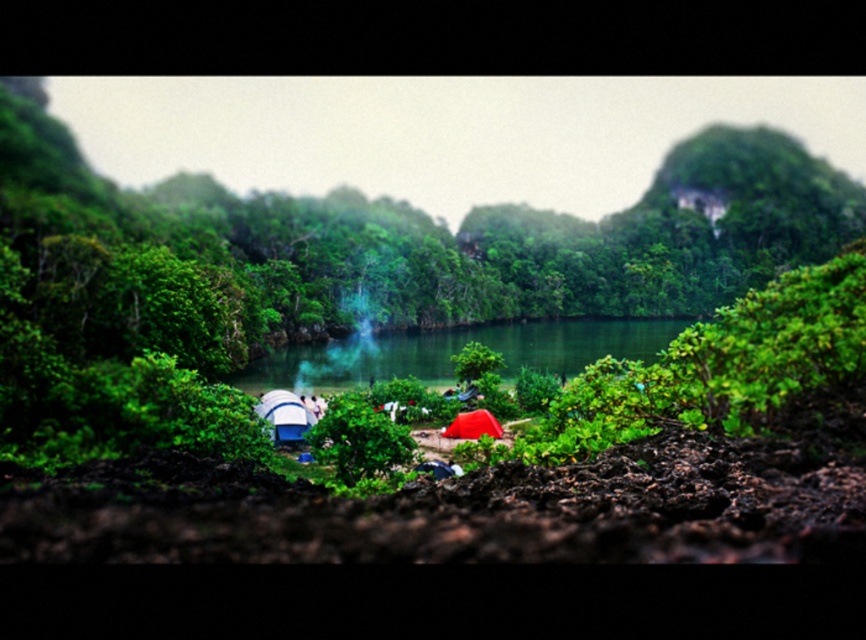
You are a hiker who wants to cross the green smooth water at center to reach the green leafy bush at center. Is the bush located to the right or left side of the water?

The green leafy bush at center is to the right of the green smooth water at center, so the bush is on the right side of the water.

You are a camper who needs to cross the green smooth water at center to reach the green leafy bush at center. Do you think you can walk across it?

The distance between the green leafy bush at center and the green smooth water at center is 26.38 meters. Since the water is smooth and calm, it might be possible to walk across if there is a path or bridge available. However, the description does not mention any such structures, so it is uncertain if walking directly across the water is feasible.

You are planning to set up a small campfire in the camping area. You have a firewood pile that is 2 meters wide. Which object between the green leafy bush at center and the green smooth water at center should you place the firewood pile next to, considering their widths?

The green leafy bush at center has a larger width than the green smooth water at center. Therefore, you should place the firewood pile next to the green leafy bush at center since it can accommodate the 2 meters width more appropriately.